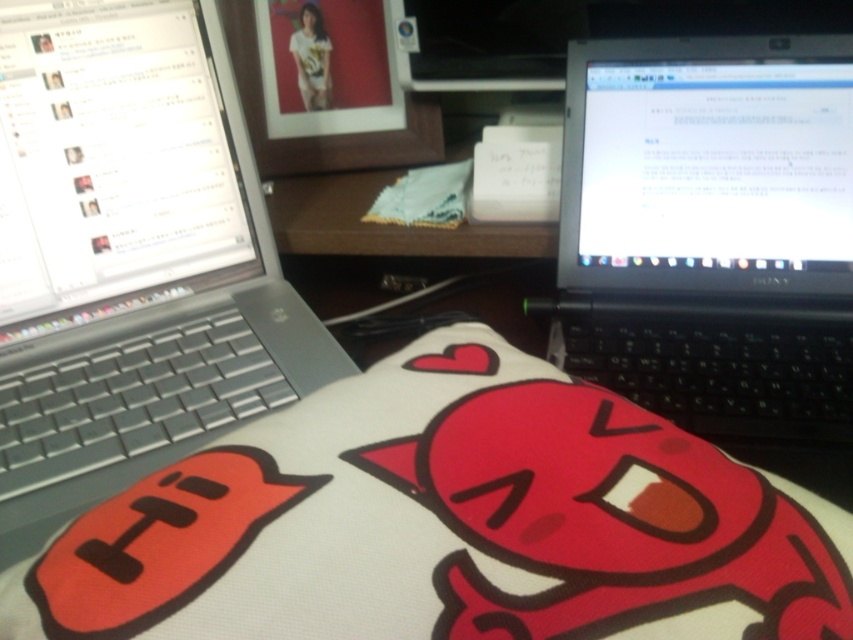
Question: Among these objects, which one is nearest to the camera?

Choices:
 (A) silver metallic laptop at left
 (B) black plastic laptop at right

Answer: (A)

Question: Is the position of silver metallic laptop at left less distant than that of black plastic laptop at right?

Choices:
 (A) yes
 (B) no

Answer: (A)

Question: Which point is closer to the camera?

Choices:
 (A) white fabric pillow with cartoon character at center
 (B) silver metallic laptop at left
 (C) black plastic laptop at right

Answer: (A)

Question: Considering the real-world distances, which object is farthest from the white fabric pillow with cartoon character at center?

Choices:
 (A) black plastic laptop at right
 (B) silver metallic laptop at left

Answer: (A)

Question: Is the position of white fabric pillow with cartoon character at center less distant than that of black plastic laptop at right?

Choices:
 (A) yes
 (B) no

Answer: (A)

Question: Does silver metallic laptop at left have a greater width compared to black plastic laptop at right?

Choices:
 (A) no
 (B) yes

Answer: (B)